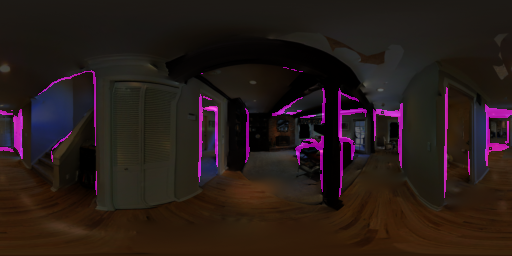
Where is `thermostat`? The height and width of the screenshot is (256, 512). thermostat is located at coordinates (190, 116).